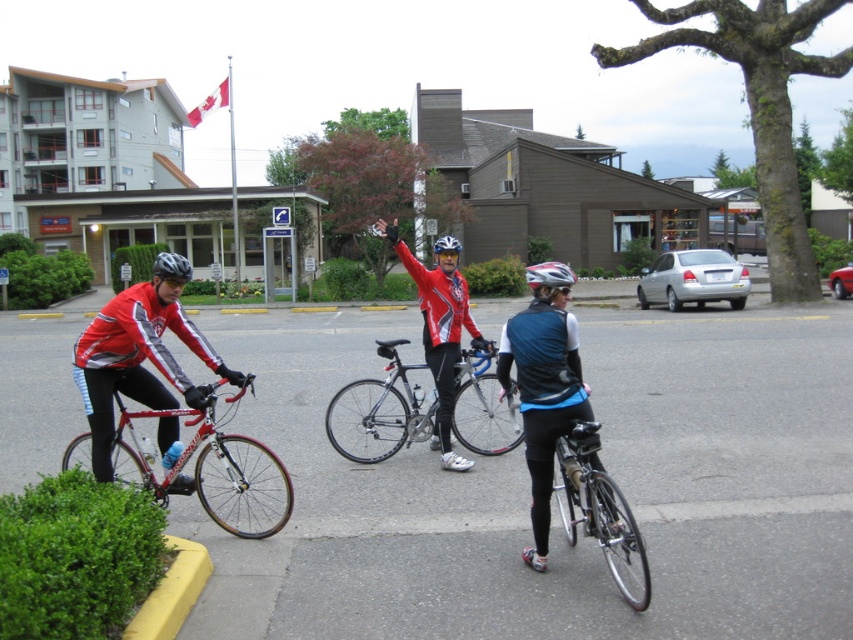
Question: Which of these objects is positioned closest to the blue/black fabric jacket at center?

Choices:
 (A) shiny red helmet at center
 (B) shiny black helmet at left
 (C) shiny black bicycle at center

Answer: (C)

Question: Estimate the real-world distances between objects in this image. Which object is closer to the shiny silver helmet at center?

Choices:
 (A) shiny red bicycle at left
 (B) shiny black helmet at left
 (C) shiny red jacket at center
 (D) shiny silver bicycle at center

Answer: (D)

Question: Among these objects, which one is nearest to the camera?

Choices:
 (A) shiny silver helmet at center
 (B) shiny black helmet at left
 (C) shiny silver bicycle at center

Answer: (C)

Question: Is shiny silver helmet at center smaller than shiny red helmet at center?

Choices:
 (A) no
 (B) yes

Answer: (A)

Question: Can you confirm if shiny silver bicycle at center is smaller than matte black helmet at center?

Choices:
 (A) no
 (B) yes

Answer: (B)

Question: Is shiny silver bicycle at center below shiny red helmet at center?

Choices:
 (A) yes
 (B) no

Answer: (A)